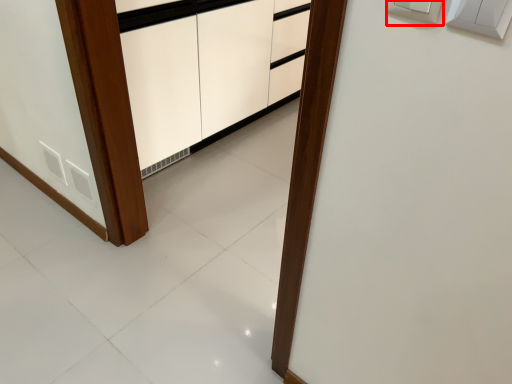
Question: From the image's perspective, where is electric outlet (annotated by the red box) located in relation to light switch in the image?

Choices:
 (A) above
 (B) below

Answer: (A)